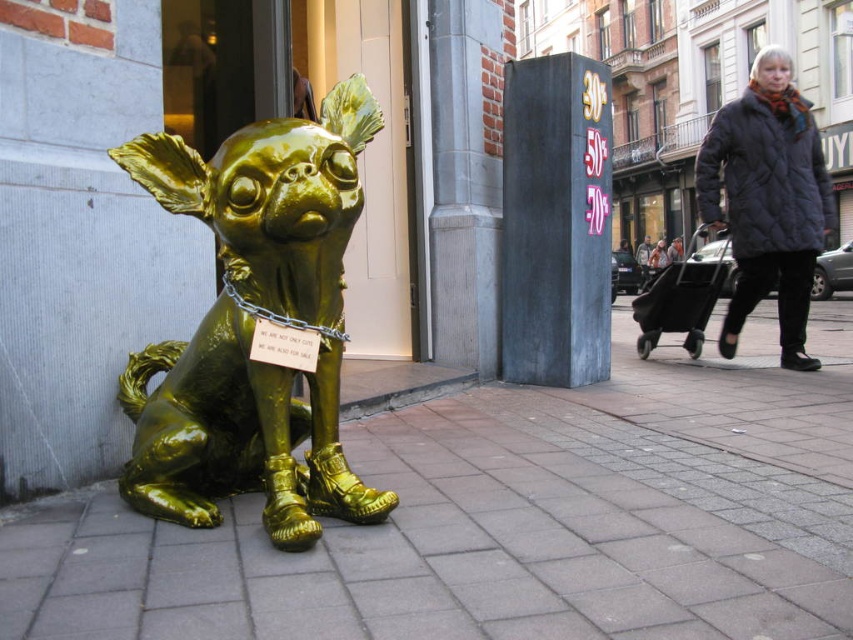
You are a city planner reviewing the sculpture placement. The glossy gold dog at left and the gold metallic chain at center are part of a new public art installation. From the viewer perspective, which object appears closer to you?

The glossy gold dog at left appears closer to you because it is positioned in front of the gold metallic chain at center.

You are a photographer standing at the camera position. You want to take a photo of the golden sculpture of a small dog. The glossy pavement at lower center is in your way. Can you step back to avoid it?

The glossy pavement at lower center is 5.79 feet away from camera. Since the pavement is at a distance, stepping back might allow you to frame the shot so the pavement is no longer blocking the view of the sculpture, but you would need to ensure the sculpture remains in focus and properly centered.